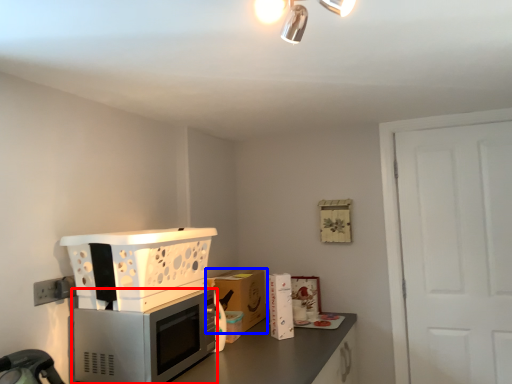
Question: Which of the following is the closest to the observer, home appliance (highlighted by a red box) or cabinetry (highlighted by a blue box)?

Choices:
 (A) home appliance
 (B) cabinetry

Answer: (A)